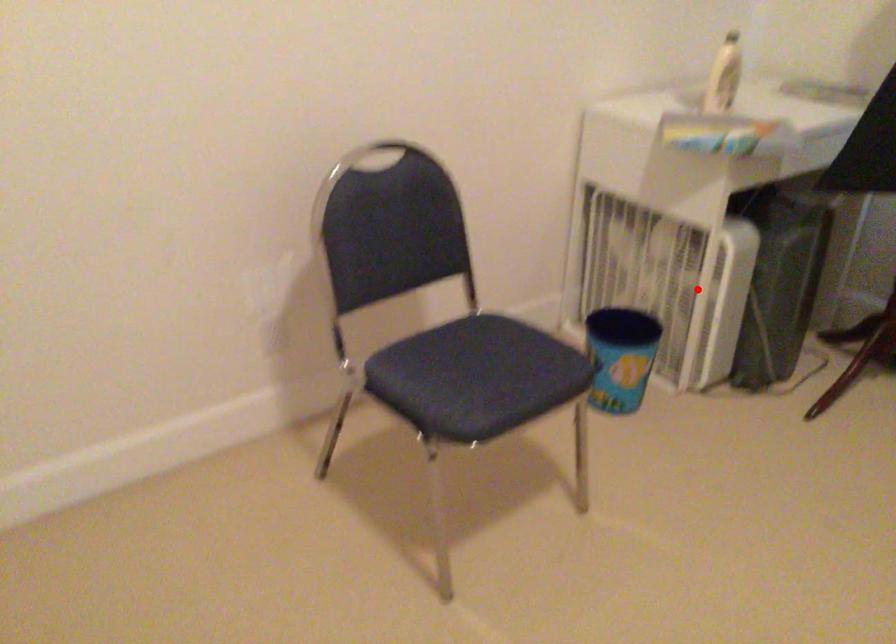
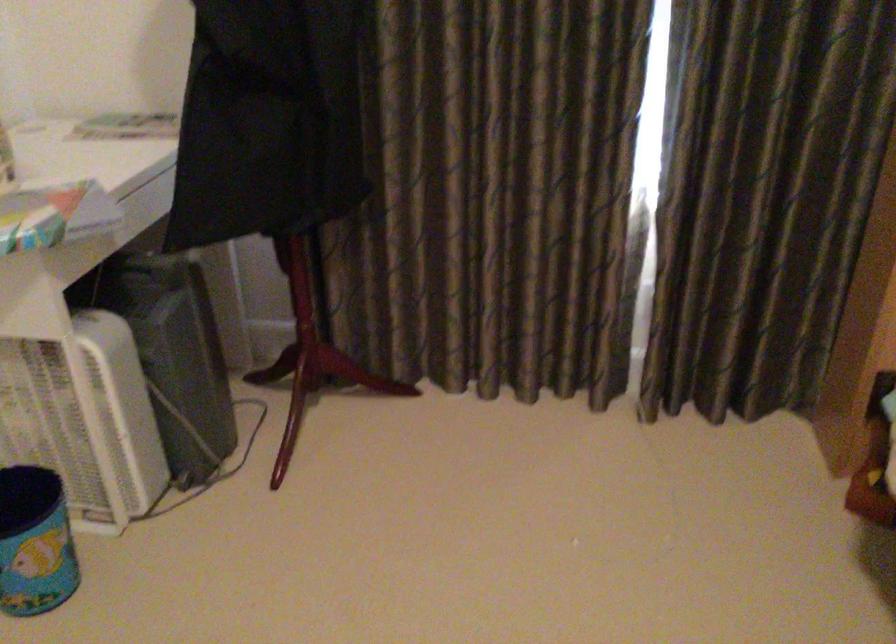
Question: I am providing you with two images of the same scene from different viewpoints. A red point is shown in image1. For the corresponding object point in image2, is it positioned nearer or farther from the camera?

Choices:
 (A) Nearer
 (B) Farther

Answer: (A)